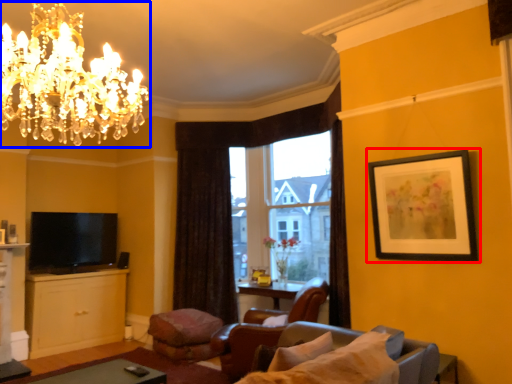
Question: Which object appears farthest to the camera in this image, picture frame (highlighted by a red box) or chandelier (highlighted by a blue box)?

Choices:
 (A) picture frame
 (B) chandelier

Answer: (A)